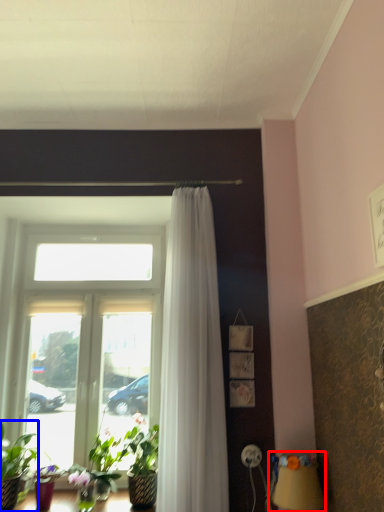
Question: Which object is closer to the camera taking this photo, table lamp (highlighted by a red box) or houseplant (highlighted by a blue box)?

Choices:
 (A) table lamp
 (B) houseplant

Answer: (A)